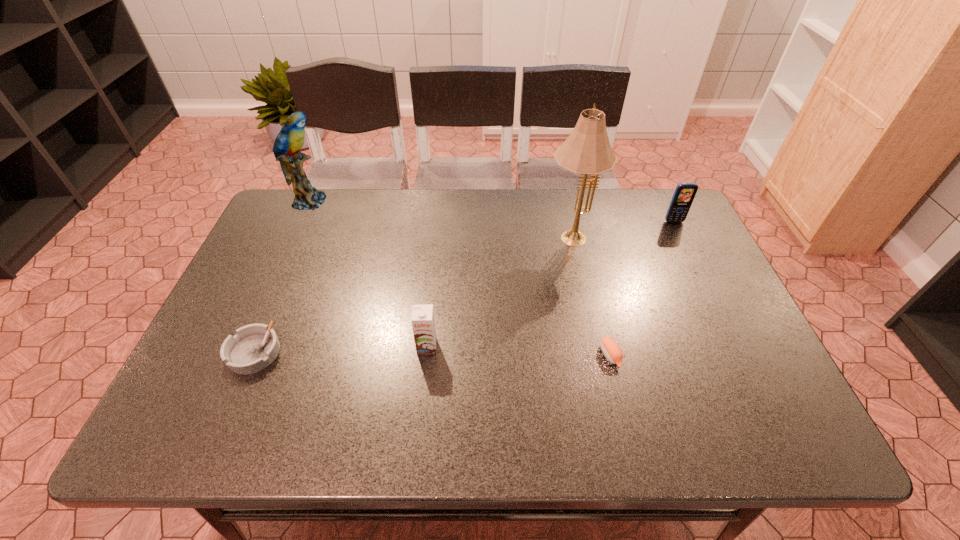
Where is `blank region between the sushi and the lampshade`? This screenshot has width=960, height=540. blank region between the sushi and the lampshade is located at coordinates (590, 295).

At what (x,y) coordinates should I click in order to perform the action: click on free spot between the lampshade and the chocolate milk. Please return your answer as a coordinate pair (x, y). Looking at the image, I should click on (499, 291).

Where is `free space that is in between the ashtray and the tallest object`? Image resolution: width=960 pixels, height=540 pixels. free space that is in between the ashtray and the tallest object is located at coordinates (413, 294).

The width and height of the screenshot is (960, 540). What are the coordinates of `vacant region between the ashtray and the tallest object` in the screenshot? It's located at (413, 294).

What are the coordinates of `vacant area that lies between the rightmost object and the lampshade` in the screenshot? It's located at (622, 228).

Locate an element on the screen. unoccupied position between the fourth object from right to left and the rightmost object is located at coordinates (550, 284).

Point out which object is positioned as the fourth nearest to the ashtray. Please provide its 2D coordinates. Your answer should be formatted as a tuple, i.e. [(x, y)], where the tuple contains the x and y coordinates of a point satisfying the conditions above.

[(611, 350)]

Where is `object that stands as the fourth closest to the farthest object`? Image resolution: width=960 pixels, height=540 pixels. object that stands as the fourth closest to the farthest object is located at coordinates (611, 350).

Locate an element on the screen. This screenshot has width=960, height=540. free point that satisfies the following two spatial constraints: 1. on the face of the fifth shortest object; 2. on the left side of the lampshade is located at coordinates (294, 235).

Identify the location of free space that satisfies the following two spatial constraints: 1. on the back side of the sushi; 2. on the face of the farthest object. (572, 201).